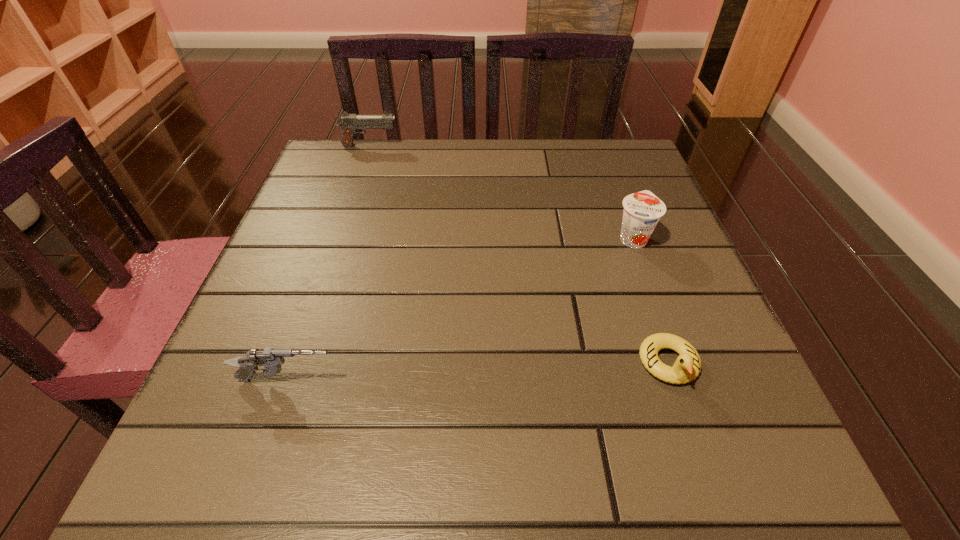
In order to click on free area in between the shorter gun and the shortest object in this screenshot , I will do `click(478, 372)`.

This screenshot has width=960, height=540. In order to click on free area in between the yogurt and the taller gun in this screenshot , I will do click(501, 192).

Identify the location of unoccupied area between the farther gun and the yogurt. (501, 192).

The image size is (960, 540). Find the location of `free spot between the duckling and the nearer gun`. free spot between the duckling and the nearer gun is located at coordinates (478, 372).

You are a GUI agent. You are given a task and a screenshot of the screen. Output one action in this format:
    pyautogui.click(x=<x>, y=<y>)
    Task: Click on the vacant space in between the nearer gun and the shortest object
    This screenshot has width=960, height=540.
    Given the screenshot: What is the action you would take?
    pyautogui.click(x=478, y=372)

Image resolution: width=960 pixels, height=540 pixels. In order to click on free space between the shorter gun and the farther gun in this screenshot , I will do `click(329, 263)`.

Identify the location of vacant region between the nearer gun and the farthest object. (329, 263).

I want to click on vacant area between the taller gun and the shorter gun, so click(329, 263).

You are a GUI agent. You are given a task and a screenshot of the screen. Output one action in this format:
    pyautogui.click(x=<x>, y=<y>)
    Task: Click on the free space that is in between the yogurt and the taller gun
    
    Given the screenshot: What is the action you would take?
    pyautogui.click(x=501, y=192)

Identify which object is located as the third nearest to the farther gun. Please provide its 2D coordinates. Your answer should be formatted as a tuple, i.e. [(x, y)], where the tuple contains the x and y coordinates of a point satisfying the conditions above.

[(687, 366)]